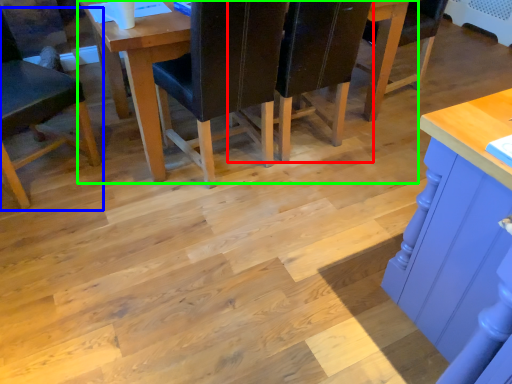
Question: Estimate the real-world distances between objects in this image. Which object is farther from chair (highlighted by a red box), chair (highlighted by a blue box) or table (highlighted by a green box)?

Choices:
 (A) chair
 (B) table

Answer: (A)